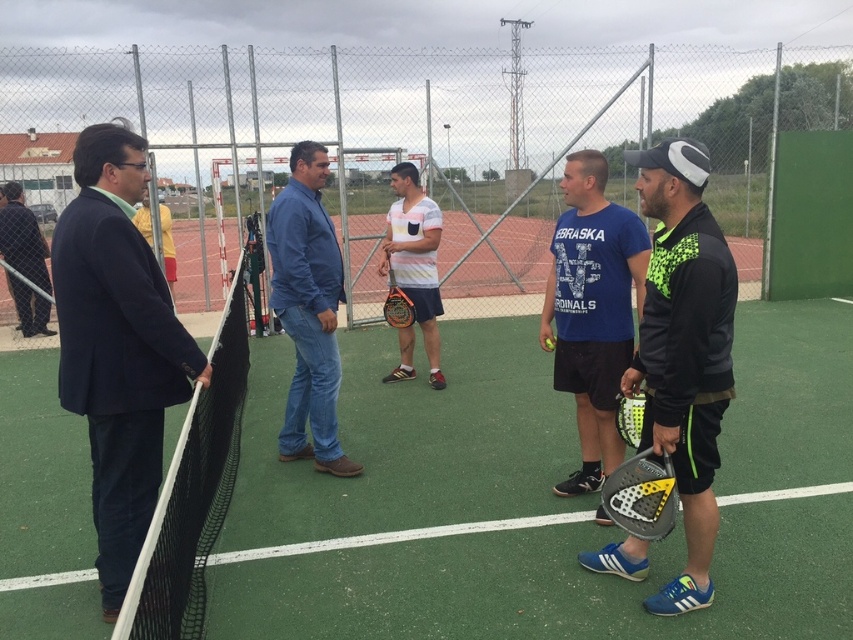
You are standing at the center of the tennis court. You need to locate the dark blue suit at left. In which direction should you look relative to your position?

You should look to the left to locate the dark blue suit at left since it is positioned at point (117, 346), which is to the left side of the court.

You are a photographer trying to capture a group photo of the individuals on the tennis court. You notice two shirts at the center of the image labeled as blue fabric shirt at center and white striped shirt at center. Which shirt should you focus on if you want to ensure the subject with the larger clothing item is in the frame?

The blue fabric shirt at center is bigger than the white striped shirt at center, so you should focus on the blue fabric shirt at center to ensure the larger clothing item is in the frame.